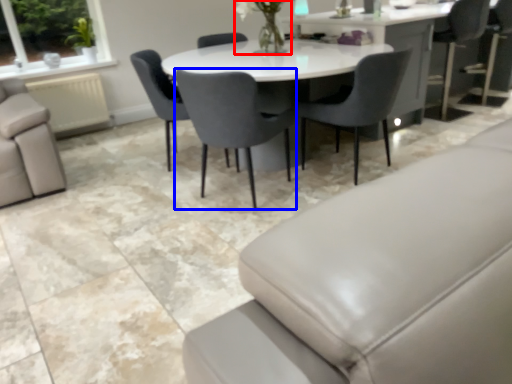
Question: Which of the following is the closest to the observer, floral arrangement (highlighted by a red box) or chair (highlighted by a blue box)?

Choices:
 (A) floral arrangement
 (B) chair

Answer: (B)